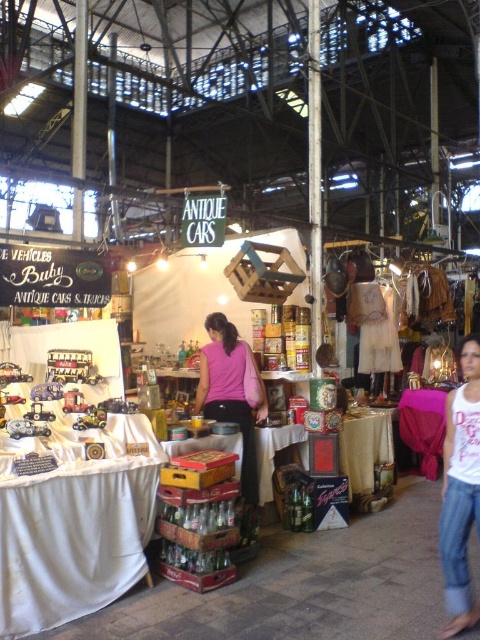
Looking at this image, measure the distance between pink cotton tank top at lower right and pink matte shirt at center.

A distance of 7.99 feet exists between pink cotton tank top at lower right and pink matte shirt at center.

Between point (456, 467) and point (224, 388), which one is positioned in front?

Positioned in front is point (456, 467).

Identify the location of pink cotton tank top at lower right. (460, 490).